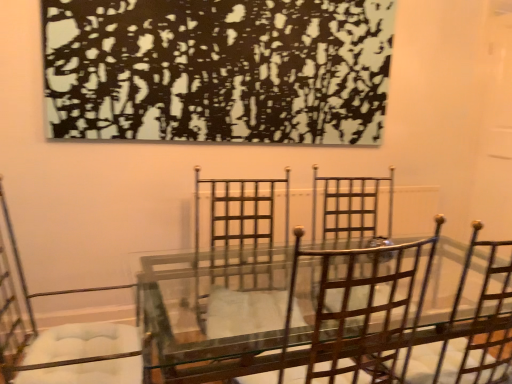
Question: In the image, is black textured painting at upper center positioned in front of or behind metallic silver chair at left, arranged as the first chair when viewed from the left?

Choices:
 (A) behind
 (B) front

Answer: (A)

Question: In terms of size, does black textured painting at upper center appear bigger or smaller than metallic silver chair at left, arranged as the first chair when viewed from the left?

Choices:
 (A) small
 (B) big

Answer: (A)

Question: Which object is the farthest from the metallic brown chair at center, which is the first chair in right-to-left order?

Choices:
 (A) black textured painting at upper center
 (B) metallic silver chair at left, the 2th chair from the right

Answer: (B)

Question: Estimate the real-world distances between objects in this image. Which object is farther from the black textured painting at upper center?

Choices:
 (A) metallic brown chair at center, the 2th chair positioned from the left
 (B) metallic silver chair at left, arranged as the first chair when viewed from the left

Answer: (A)